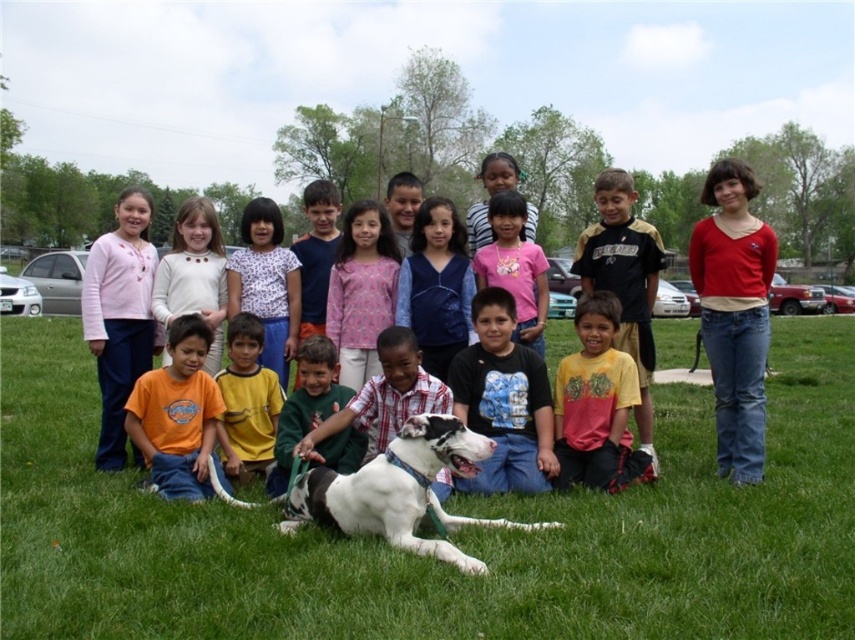
Question: Does pink fabric shirt at center come behind yellow shirt at center?

Choices:
 (A) yes
 (B) no

Answer: (A)

Question: Which object is farther from the camera taking this photo?

Choices:
 (A) blue velvet vest at center
 (B) orange cotton shirt at lower left
 (C) yellow shirt at center

Answer: (A)

Question: Which point is closer to the camera?

Choices:
 (A) blue velvet vest at center
 (B) black cotton shirt at center

Answer: (B)

Question: Which is nearer to the blue velvet vest at center?

Choices:
 (A) black cotton shirt at center
 (B) pink fabric shirt at center
 (C) pink cotton shirt at center

Answer: (B)

Question: In this image, where is green grass at lower center located relative to black cotton shirt at center?

Choices:
 (A) right
 (B) left

Answer: (B)

Question: Can you confirm if pink fabric shirt at center is thinner than pink cotton shirt at center?

Choices:
 (A) yes
 (B) no

Answer: (A)